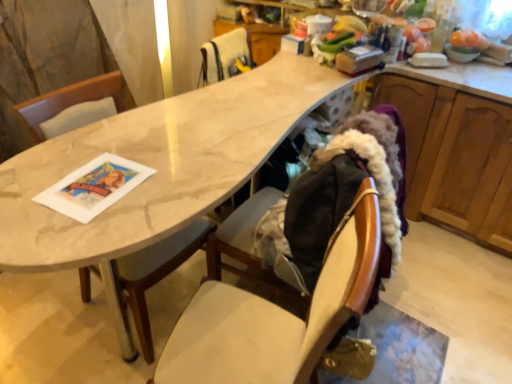
Locate an element on the screen. free space above wooden cabinet at right (from a real-world perspective) is located at coordinates (471, 73).